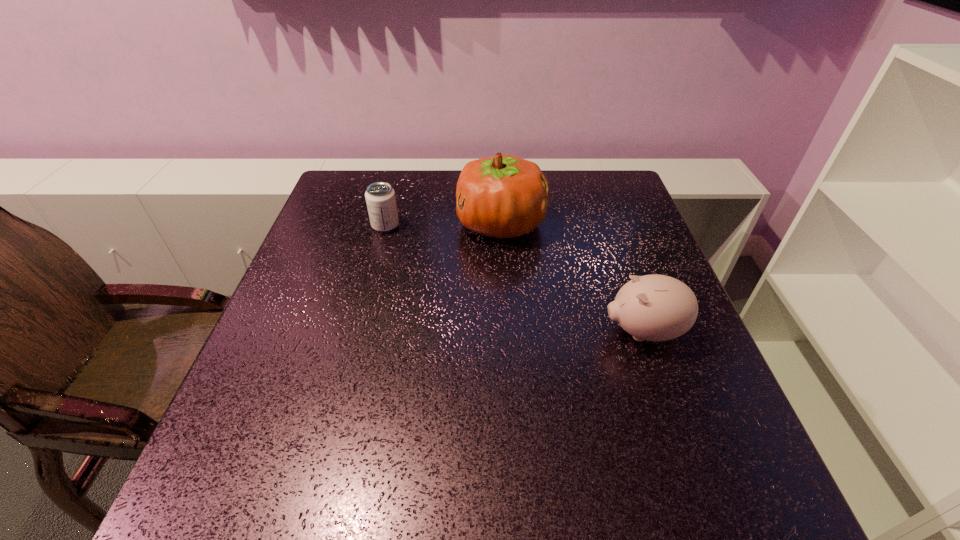
The width and height of the screenshot is (960, 540). Find the location of `vacant point located at the snout of the second shortest object`. vacant point located at the snout of the second shortest object is located at coordinates (411, 332).

Locate an element on the screen. free region located at the snout of the second shortest object is located at coordinates (473, 332).

The height and width of the screenshot is (540, 960). I want to click on free location located on the front of the leftmost object, so (362, 315).

This screenshot has width=960, height=540. I want to click on object situated at the far edge, so click(504, 196).

This screenshot has height=540, width=960. What are the coordinates of `object at the left edge` in the screenshot? It's located at (380, 197).

Identify the location of object at the right edge. (654, 307).

The height and width of the screenshot is (540, 960). I want to click on blank space at the far edge, so click(432, 194).

Find the location of a particular element. This screenshot has width=960, height=540. free space at the near edge is located at coordinates (468, 481).

Where is `vacant position at the left edge of the desktop`? This screenshot has width=960, height=540. vacant position at the left edge of the desktop is located at coordinates (342, 305).

Where is `free space at the right edge of the desktop`? Image resolution: width=960 pixels, height=540 pixels. free space at the right edge of the desktop is located at coordinates (638, 350).